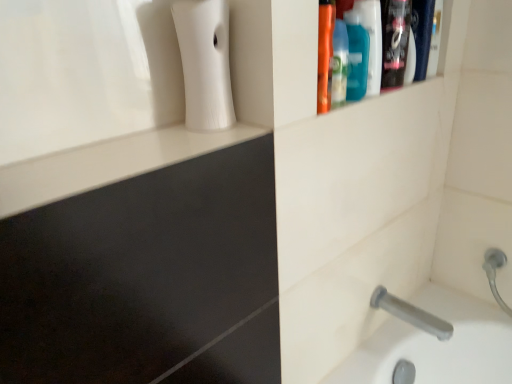
In the scene shown: Measure the distance between point (x=210, y=52) and camera.

Point (x=210, y=52) is 24.96 inches away from camera.

In order to face shiny black bottle at upper right, should I rotate leftwards or rightwards?

To align with it, rotate right about 19.844°.

This screenshot has width=512, height=384. Describe the element at coordinates (395, 41) in the screenshot. I see `shiny black bottle at upper right` at that location.

How much space does translucent plastic mouthwash at upper right, the second mouthwash from the right, occupy vertically?

It is 6.69 inches.

I want to click on white matte soap dispenser at upper left, so click(x=205, y=63).

From a real-world perspective, between translucent plastic mouthwash at upper right, the second mouthwash from the right, and white matte soap dispenser at upper left, who is vertically lower?

From a 3D spatial view, translucent plastic mouthwash at upper right, the second mouthwash from the right, is below.

From the picture: Could you measure the distance between translucent plastic mouthwash at upper right, acting as the 1th mouthwash starting from the left, and white matte soap dispenser at upper left?

They are 11.35 inches apart.

In the scene shown: Do you think translucent plastic mouthwash at upper right, acting as the 1th mouthwash starting from the left, is within white matte soap dispenser at upper left, or outside of it?

translucent plastic mouthwash at upper right, acting as the 1th mouthwash starting from the left, is spatially situated outside white matte soap dispenser at upper left.

From the image's perspective, is translucent plastic mouthwash at upper right, the second mouthwash from the right, located beneath white matte soap dispenser at upper left?

Actually, translucent plastic mouthwash at upper right, the second mouthwash from the right, appears above white matte soap dispenser at upper left in the image.

From a real-world perspective, does translucent plastic mouthwash at upper right, acting as the 1th mouthwash starting from the left, stand above shiny black bottle at upper right?

Yes.

Is translucent plastic mouthwash at upper right, the second mouthwash from the right, positioned in front of shiny black bottle at upper right?

Yes, translucent plastic mouthwash at upper right, the second mouthwash from the right, is in front of shiny black bottle at upper right.

Between translucent plastic mouthwash at upper right, acting as the 1th mouthwash starting from the left, and shiny black bottle at upper right, which one has larger size?

translucent plastic mouthwash at upper right, acting as the 1th mouthwash starting from the left.

Looking at this image, from a real-world perspective, does white matte soap dispenser at upper left sit lower than teal plastic mouthwash at upper right, positioned as the first mouthwash in right-to-left order?

Yes, from a real-world perspective, white matte soap dispenser at upper left is below teal plastic mouthwash at upper right, positioned as the first mouthwash in right-to-left order.

Is point (210, 83) farther from viewer compared to point (376, 51)?

No, (210, 83) is in front of (376, 51).

Which of these two, white matte soap dispenser at upper left or teal plastic mouthwash at upper right, positioned as the first mouthwash in right-to-left order, is smaller?

teal plastic mouthwash at upper right, positioned as the first mouthwash in right-to-left order.

Is translucent plastic mouthwash at upper right, the second mouthwash from the right, positioned with its back to teal plastic mouthwash at upper right, positioned as the first mouthwash in right-to-left order?

That's not correct — translucent plastic mouthwash at upper right, the second mouthwash from the right, is not looking away from teal plastic mouthwash at upper right, positioned as the first mouthwash in right-to-left order.

Based on their positions, is translucent plastic mouthwash at upper right, acting as the 1th mouthwash starting from the left, located to the left or right of teal plastic mouthwash at upper right, which is counted as the 2th mouthwash, starting from the left?

From the image, it's evident that translucent plastic mouthwash at upper right, acting as the 1th mouthwash starting from the left, is to the left of teal plastic mouthwash at upper right, which is counted as the 2th mouthwash, starting from the left.

Based on their sizes in the image, would you say translucent plastic mouthwash at upper right, acting as the 1th mouthwash starting from the left, is bigger or smaller than teal plastic mouthwash at upper right, positioned as the first mouthwash in right-to-left order?

translucent plastic mouthwash at upper right, acting as the 1th mouthwash starting from the left, is smaller than teal plastic mouthwash at upper right, positioned as the first mouthwash in right-to-left order.

Relative to teal plastic mouthwash at upper right, positioned as the first mouthwash in right-to-left order, is translucent plastic mouthwash at upper right, acting as the 1th mouthwash starting from the left, in front or behind?

Visually, translucent plastic mouthwash at upper right, acting as the 1th mouthwash starting from the left, is located in front of teal plastic mouthwash at upper right, positioned as the first mouthwash in right-to-left order.

Can you confirm if gray matte tap at lower right is thinner than shiny black bottle at upper right?

No, gray matte tap at lower right is not thinner than shiny black bottle at upper right.

Which is more to the left, gray matte tap at lower right or shiny black bottle at upper right?

From the viewer's perspective, shiny black bottle at upper right appears more on the left side.

Is gray matte tap at lower right far from shiny black bottle at upper right?

No, there isn't a large distance between gray matte tap at lower right and shiny black bottle at upper right.

From the image's perspective, does teal plastic mouthwash at upper right, positioned as the first mouthwash in right-to-left order, appear lower than translucent plastic mouthwash at upper right, acting as the 1th mouthwash starting from the left?

No, from the image's perspective, teal plastic mouthwash at upper right, positioned as the first mouthwash in right-to-left order, is not below translucent plastic mouthwash at upper right, acting as the 1th mouthwash starting from the left.

How far apart are teal plastic mouthwash at upper right, which is counted as the 2th mouthwash, starting from the left, and translucent plastic mouthwash at upper right, acting as the 1th mouthwash starting from the left?

teal plastic mouthwash at upper right, which is counted as the 2th mouthwash, starting from the left, is 0.95 inches from translucent plastic mouthwash at upper right, acting as the 1th mouthwash starting from the left.

Is teal plastic mouthwash at upper right, which is counted as the 2th mouthwash, starting from the left, oriented away from translucent plastic mouthwash at upper right, the second mouthwash from the right?

teal plastic mouthwash at upper right, which is counted as the 2th mouthwash, starting from the left, is not turned away from translucent plastic mouthwash at upper right, the second mouthwash from the right.

From a real-world perspective, which object rests below the other?

translucent plastic mouthwash at upper right, the second mouthwash from the right, from a real-world perspective.

Is white matte soap dispenser at upper left not inside translucent plastic mouthwash at upper right, acting as the 1th mouthwash starting from the left?

Yes.

Considering the positions of point (221, 7) and point (356, 43), is point (221, 7) closer or farther from the camera than point (356, 43)?

Point (221, 7).

Measure the distance between white matte soap dispenser at upper left and translucent plastic mouthwash at upper right, the second mouthwash from the right.

white matte soap dispenser at upper left is 11.35 inches from translucent plastic mouthwash at upper right, the second mouthwash from the right.

What are the coordinates of `the 1st mouthwash behind when counting from the white matte soap dispenser at upper left` in the screenshot? It's located at (356, 56).

The image size is (512, 384). In the image, there is a translucent plastic mouthwash at upper right, acting as the 1th mouthwash starting from the left. In order to click on cleaning product above it (from the image's perspective) in this screenshot , I will do `click(395, 41)`.

When comparing their distances from shiny black bottle at upper right, does gray matte tap at lower right or translucent plastic mouthwash at upper right, acting as the 1th mouthwash starting from the left, seem further?

Among the two, gray matte tap at lower right is located further to shiny black bottle at upper right.

Based on their spatial positions, is teal plastic mouthwash at upper right, which is counted as the 2th mouthwash, starting from the left, or shiny black bottle at upper right further from gray matte tap at lower right?

The object further to gray matte tap at lower right is teal plastic mouthwash at upper right, which is counted as the 2th mouthwash, starting from the left.

When comparing their distances from gray matte tap at lower right, does translucent plastic mouthwash at upper right, acting as the 1th mouthwash starting from the left, or white matte soap dispenser at upper left seem further?

white matte soap dispenser at upper left lies further to gray matte tap at lower right than the other object.

Looking at the image, which one is located closer to teal plastic mouthwash at upper right, positioned as the first mouthwash in right-to-left order, shiny black bottle at upper right or translucent plastic mouthwash at upper right, acting as the 1th mouthwash starting from the left?

Among the two, translucent plastic mouthwash at upper right, acting as the 1th mouthwash starting from the left, is located nearer to teal plastic mouthwash at upper right, positioned as the first mouthwash in right-to-left order.

Which object lies nearer to the anchor point translucent plastic mouthwash at upper right, acting as the 1th mouthwash starting from the left, white matte soap dispenser at upper left or shiny black bottle at upper right?

shiny black bottle at upper right is positioned closer to the anchor translucent plastic mouthwash at upper right, acting as the 1th mouthwash starting from the left.

Looking at the image, which one is located closer to white matte soap dispenser at upper left, translucent plastic mouthwash at upper right, acting as the 1th mouthwash starting from the left, or shiny black bottle at upper right?

translucent plastic mouthwash at upper right, acting as the 1th mouthwash starting from the left, is positioned closer to the anchor white matte soap dispenser at upper left.

From the picture: Estimate the real-world distances between objects in this image. Which object is closer to gray matte tap at lower right, white matte soap dispenser at upper left or translucent plastic mouthwash at upper right, acting as the 1th mouthwash starting from the left?

Among the two, translucent plastic mouthwash at upper right, acting as the 1th mouthwash starting from the left, is located nearer to gray matte tap at lower right.

When comparing their distances from translucent plastic mouthwash at upper right, the second mouthwash from the right, does white matte soap dispenser at upper left or teal plastic mouthwash at upper right, positioned as the first mouthwash in right-to-left order, seem further?

Based on the image, white matte soap dispenser at upper left appears to be further to translucent plastic mouthwash at upper right, the second mouthwash from the right.

I want to click on mouthwash between white matte soap dispenser at upper left and teal plastic mouthwash at upper right, positioned as the first mouthwash in right-to-left order, from left to right, so click(x=356, y=56).

Image resolution: width=512 pixels, height=384 pixels. Find the location of `mouthwash between translucent plastic mouthwash at upper right, the second mouthwash from the right, and shiny black bottle at upper right`. mouthwash between translucent plastic mouthwash at upper right, the second mouthwash from the right, and shiny black bottle at upper right is located at coordinates (372, 42).

Find the location of a particular element. This screenshot has height=384, width=512. soap dispenser between translucent plastic mouthwash at upper right, the second mouthwash from the right, and gray matte tap at lower right, in the vertical direction is located at coordinates (205, 63).

The image size is (512, 384). Find the location of `soap dispenser between shiny black bottle at upper right and gray matte tap at lower right in the vertical direction`. soap dispenser between shiny black bottle at upper right and gray matte tap at lower right in the vertical direction is located at coordinates pos(205,63).